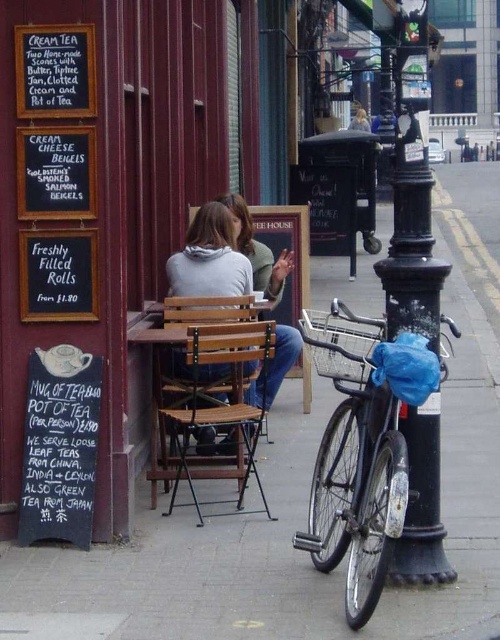
You are standing at the entrance of the cafe and want to find the black metal pole at right. Which direction should you look to locate it?

The black metal pole at right is located at the right side of the cafe entrance, so you should look to your right to locate it.

You are standing in front of the cafe and want to check both the black metal pole at right and the white chalkboard at lower left. Which object is closer to you?

The black metal pole at right is closer to the viewer than the white chalkboard at lower left.